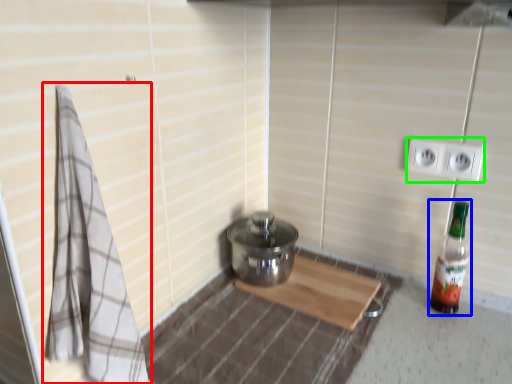
Question: Which object is positioned farthest from bath towel (highlighted by a red box)? Select from bottle (highlighted by a blue box) and electric outlet (highlighted by a green box).

Choices:
 (A) bottle
 (B) electric outlet

Answer: (B)